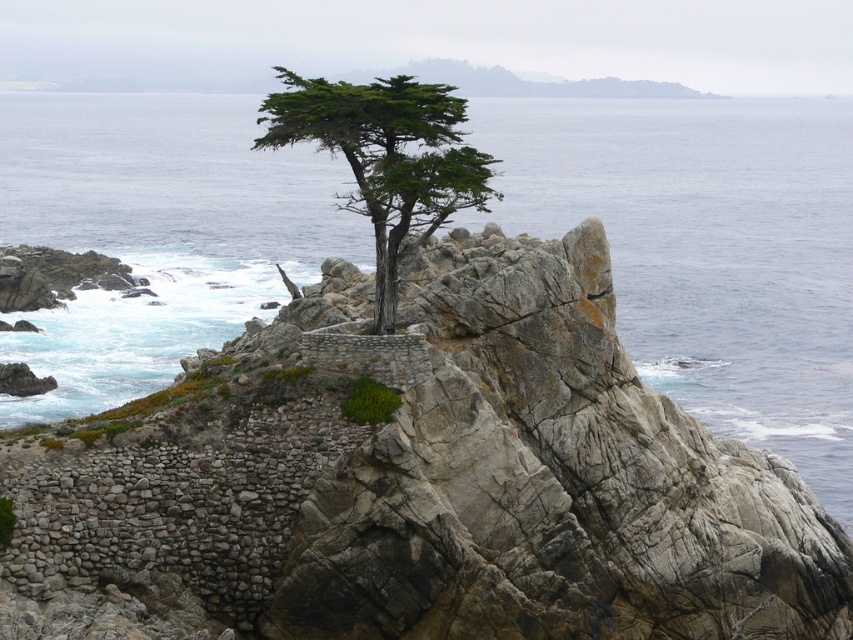
You are a hiker standing at the base of the green textured tree at center and want to reach the blue water at upper center. Which direction should you move to get there?

The blue water at upper center is positioned on the left side of the green textured tree at center, so you should move to the left to reach it.